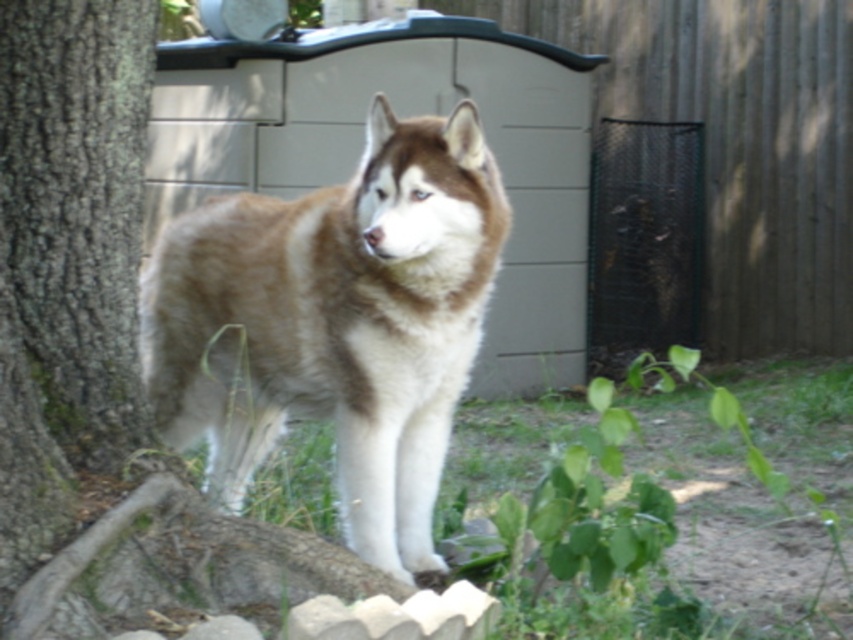
Which is more to the right, brown and white fur at center or brown rough tree trunk at left?

From the viewer's perspective, brown and white fur at center appears more on the right side.

Between brown and white fur at center and brown rough tree trunk at left, which one appears on the left side from the viewer's perspective?

brown rough tree trunk at left

Is point (410, 467) more distant than point (26, 253)?

Yes, it is behind point (26, 253).

Image resolution: width=853 pixels, height=640 pixels. I want to click on brown and white fur at center, so point(335,323).